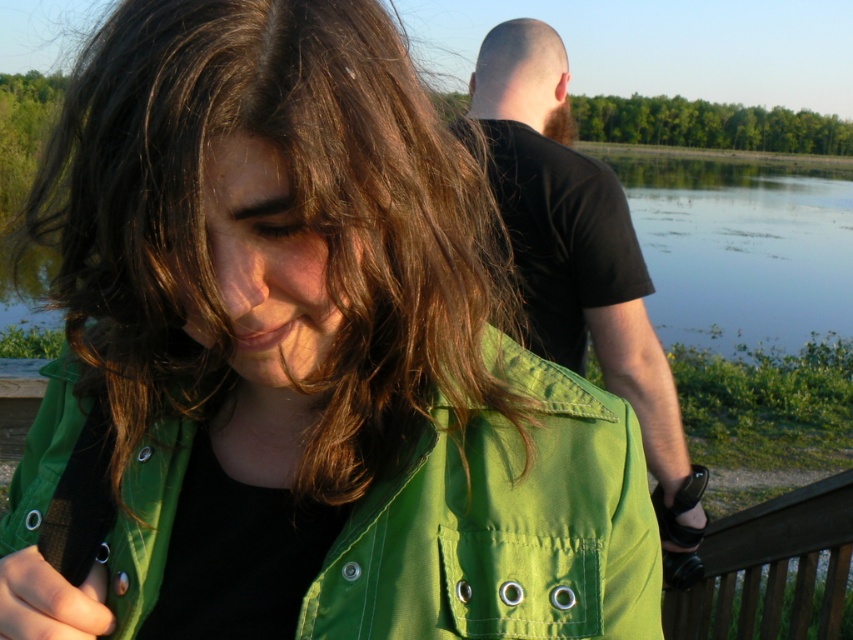
Who is taller, black cotton t-shirt at upper right or clear water at lake right?

clear water at lake right

Where is `black cotton t-shirt at upper right`? Image resolution: width=853 pixels, height=640 pixels. black cotton t-shirt at upper right is located at coordinates (581, 262).

Find the location of a particular element. black cotton t-shirt at upper right is located at coordinates (581, 262).

Which is more to the left, black cotton t-shirt at upper right or brown wooden rail at lower right?

Positioned to the left is black cotton t-shirt at upper right.

Image resolution: width=853 pixels, height=640 pixels. What do you see at coordinates (581, 262) in the screenshot?
I see `black cotton t-shirt at upper right` at bounding box center [581, 262].

Where is `black cotton t-shirt at upper right`? The width and height of the screenshot is (853, 640). black cotton t-shirt at upper right is located at coordinates (581, 262).

Between clear water at lake right and brown wooden rail at lower right, which one is positioned lower?

Positioned lower is brown wooden rail at lower right.

Is clear water at lake right further to the viewer compared to brown wooden rail at lower right?

Yes, clear water at lake right is behind brown wooden rail at lower right.

This screenshot has height=640, width=853. I want to click on clear water at lake right, so click(x=740, y=244).